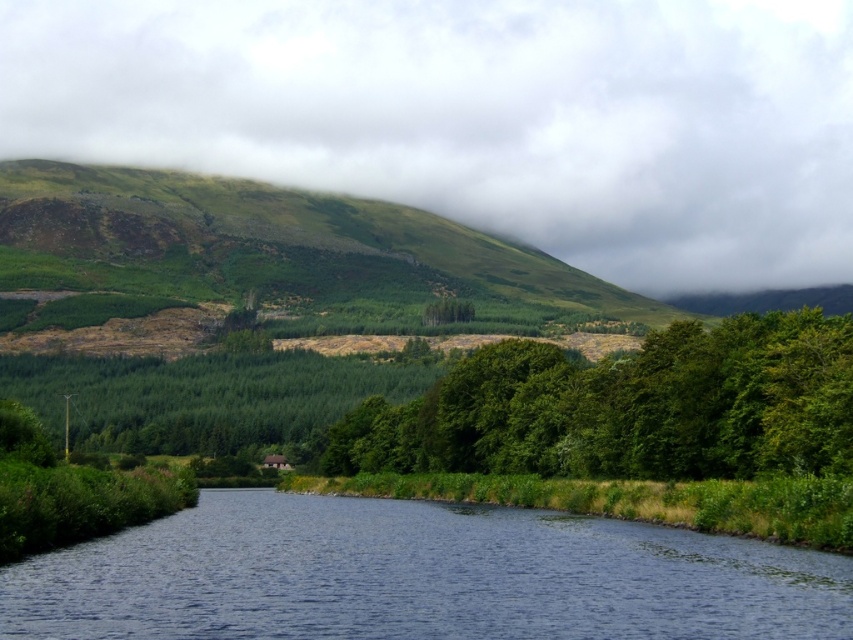
Does green matte hillside at upper center come behind green leafy trees at center?

Yes, it is.

Is green matte hillside at upper center closer to camera compared to green leafy trees at center?

That is False.

Find the location of a particular element. The width and height of the screenshot is (853, 640). green matte hillside at upper center is located at coordinates (480, 116).

Find the location of a particular element. green matte hillside at upper center is located at coordinates (480, 116).

Can you confirm if green matte hillside at upper center is shorter than green grassy hillside at upper left?

No, green matte hillside at upper center is not shorter than green grassy hillside at upper left.

Between green matte hillside at upper center and green grassy hillside at upper left, which one has more height?

With more height is green matte hillside at upper center.

Does point (276, 19) lie in front of point (141, 248)?

No, (276, 19) is further to viewer.

I want to click on green matte hillside at upper center, so click(x=480, y=116).

Looking at this image, between green matte hillside at upper center and blue water at center, which one is positioned higher?

green matte hillside at upper center

Between green matte hillside at upper center and blue water at center, which one appears on the left side from the viewer's perspective?

blue water at center is more to the left.

Between point (0, 36) and point (787, 632), which one is positioned in front?

Positioned in front is point (787, 632).

At what (x,y) coordinates should I click in order to perform the action: click on green matte hillside at upper center. Please return your answer as a coordinate pair (x, y). The image size is (853, 640). Looking at the image, I should click on [x=480, y=116].